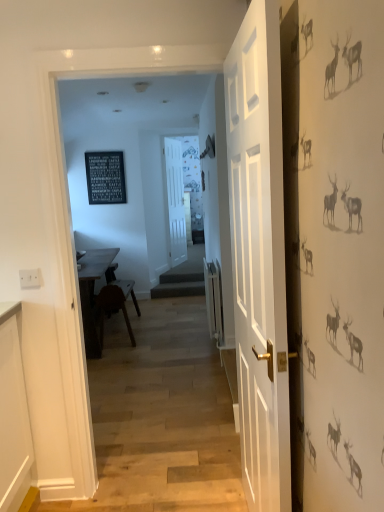
Question: Can you confirm if white wooden door at center, which is the first door from front to back, is positioned to the right of white matte door at center, the 2th door viewed from the right?

Choices:
 (A) no
 (B) yes

Answer: (B)

Question: From the image's perspective, is white wooden door at center, which is the first door from front to back, on top of white matte door at center, the 1th door in the back-to-front sequence?

Choices:
 (A) no
 (B) yes

Answer: (A)

Question: Considering the relative sizes of white wooden door at center, the first door from the right, and white matte door at center, the first door positioned from the left, in the image provided, is white wooden door at center, the first door from the right, taller than white matte door at center, the first door positioned from the left,?

Choices:
 (A) no
 (B) yes

Answer: (B)

Question: Is white wooden door at center, the 2th door when ordered from back to front, facing away from white matte door at center, the first door positioned from the left?

Choices:
 (A) yes
 (B) no

Answer: (B)

Question: Is white wooden door at center, arranged as the second door when viewed from the left, thinner than white matte door at center, the 2th door viewed from the right?

Choices:
 (A) yes
 (B) no

Answer: (A)

Question: Is white wooden door at center, which is the first door from front to back, placed right next to white matte door at center, the 2th door viewed from the right?

Choices:
 (A) yes
 (B) no

Answer: (B)

Question: Is wooden table at center far away from white wooden door at center, the 2th door when ordered from back to front?

Choices:
 (A) yes
 (B) no

Answer: (A)

Question: Is wooden table at center at the left side of white wooden door at center, the first door from the right?

Choices:
 (A) yes
 (B) no

Answer: (A)

Question: Can you confirm if wooden table at center is thinner than white wooden door at center, the first door from the right?

Choices:
 (A) yes
 (B) no

Answer: (B)

Question: Considering the relative positions of wooden table at center and white wooden door at center, which is the first door from front to back, in the image provided, is wooden table at center to the right of white wooden door at center, which is the first door from front to back, from the viewer's perspective?

Choices:
 (A) yes
 (B) no

Answer: (B)

Question: Is wooden table at center oriented towards white wooden door at center, arranged as the second door when viewed from the left?

Choices:
 (A) no
 (B) yes

Answer: (A)

Question: Is wooden table at center outside of white wooden door at center, which is the first door from front to back?

Choices:
 (A) no
 (B) yes

Answer: (B)

Question: Can we say white wooden door at center, which is the first door from front to back, lies outside black slate sign at upper center?

Choices:
 (A) no
 (B) yes

Answer: (B)